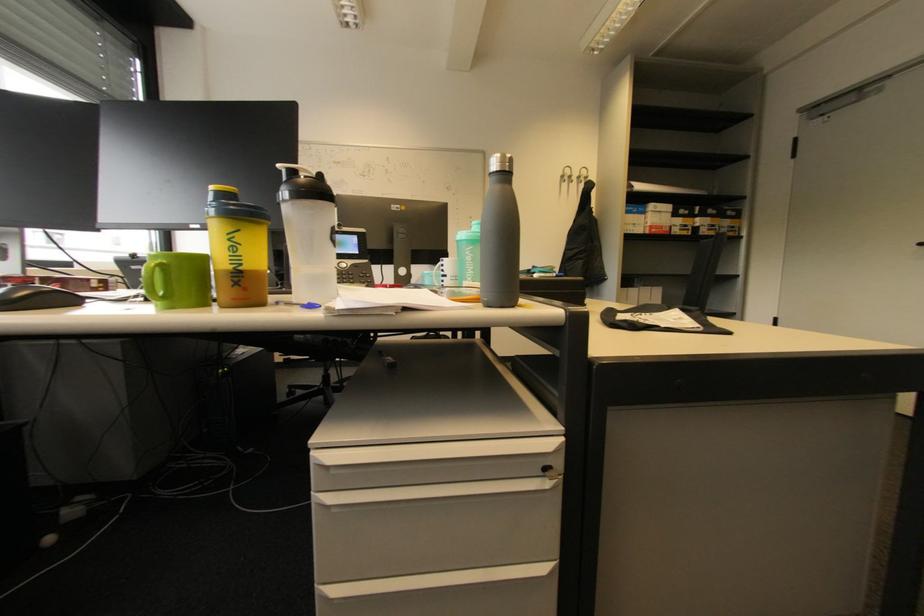
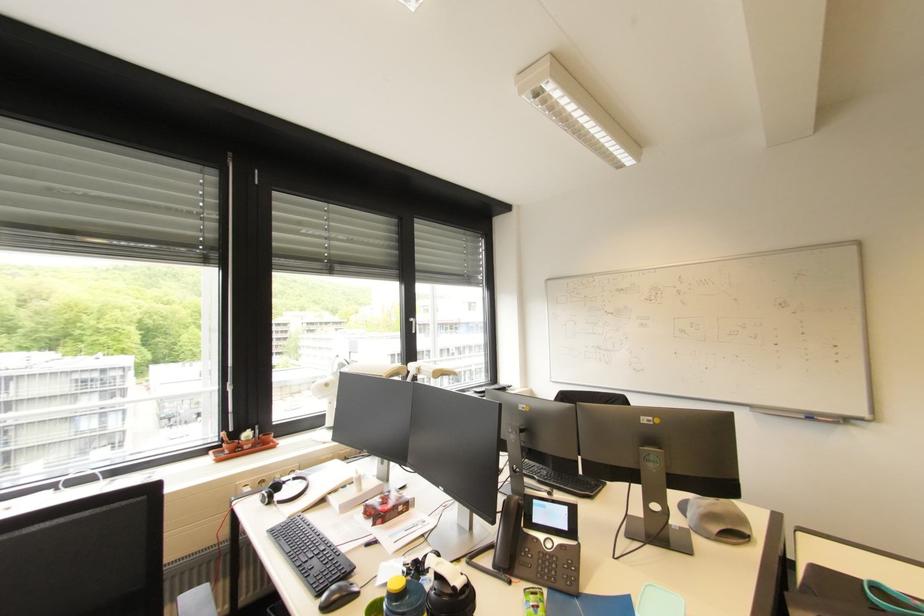
Where in the second image is the point corresponding to (x=360, y=237) from the first image?

(572, 509)